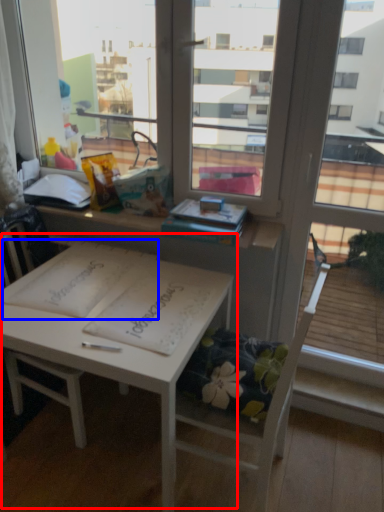
Question: Which of the following is the closest to the observer, table (highlighted by a red box) or notebook (highlighted by a blue box)?

Choices:
 (A) table
 (B) notebook

Answer: (A)